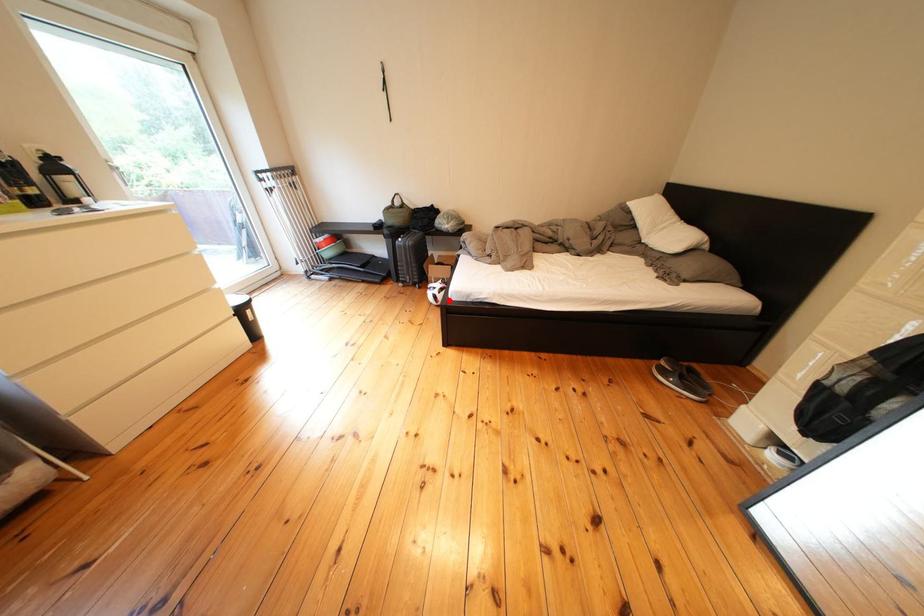
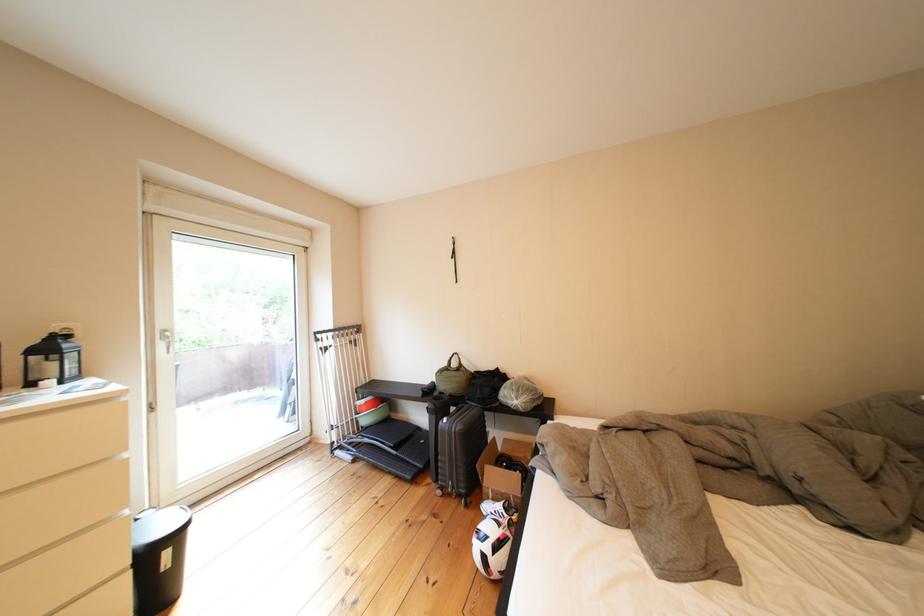
Find the pixel in the second image that matches the highlighted location in the first image.

(499, 562)